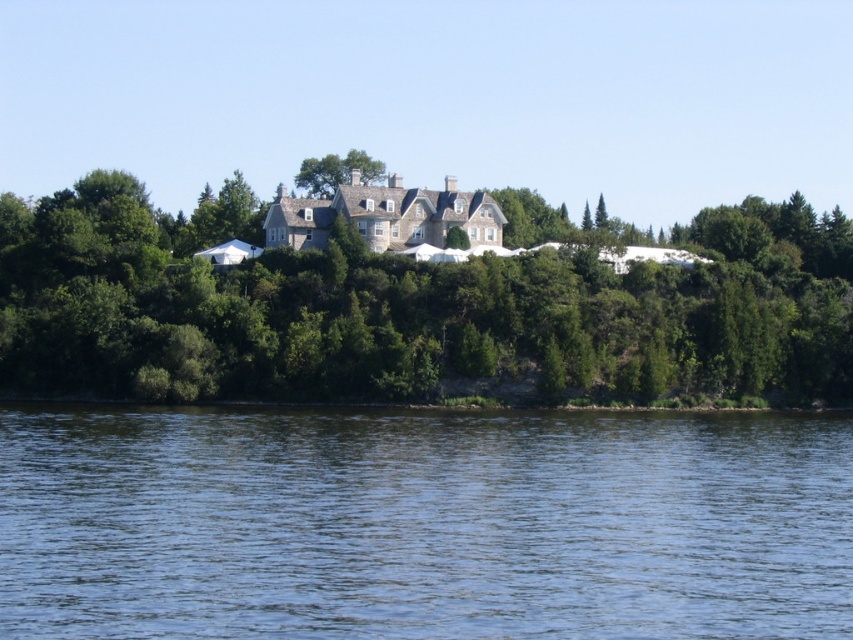
You are standing at the center of the image and want to walk directly towards the green leafy tree at center. Based on its position, in which direction should you move?

The green leafy tree at center is located at point coordinates of (409, 305), which is very close to the center of the image. Therefore, moving directly towards it from the center would require staying on the same spot or making minimal adjustments since it is already centered.